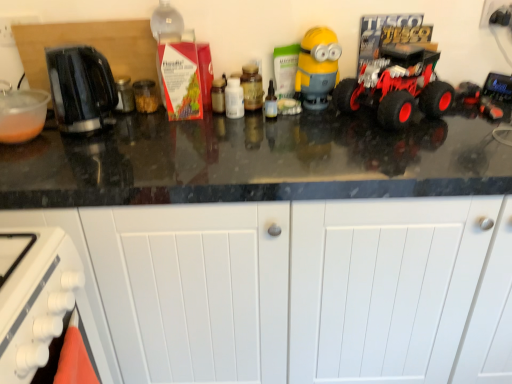
Find the location of `free space in front of yellow matte minion at center`. free space in front of yellow matte minion at center is located at coordinates (336, 131).